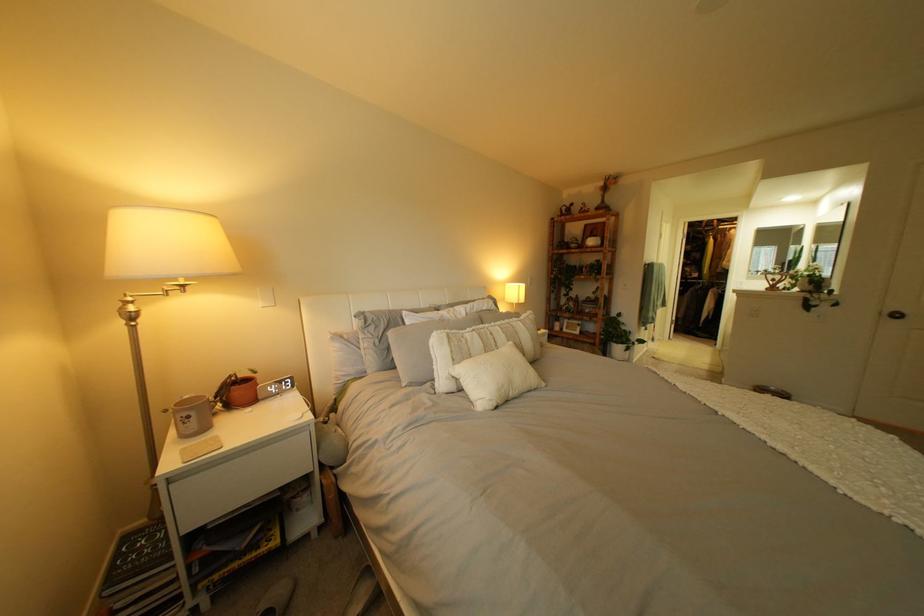
Locate an element on the screen. This screenshot has height=616, width=924. striped decorative pillow is located at coordinates (480, 346).